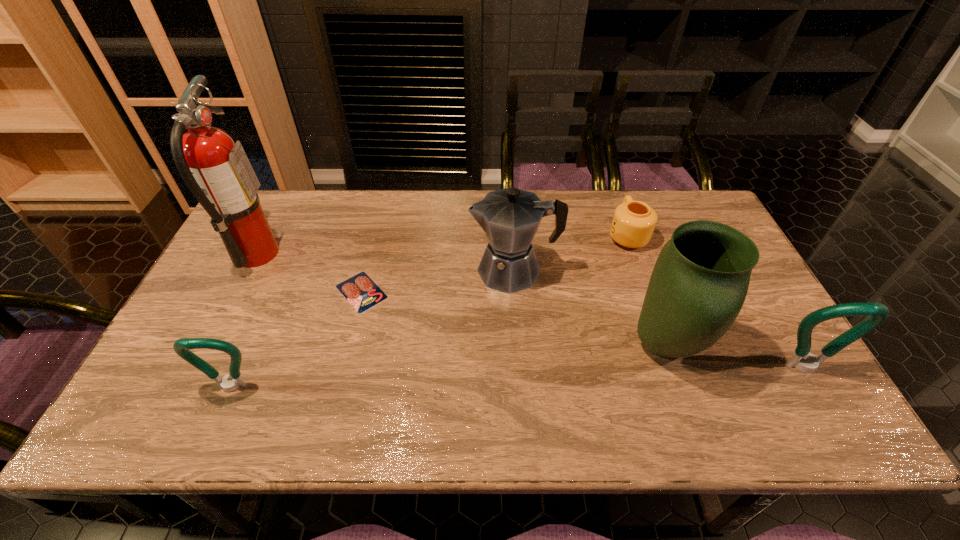
Identify the location of free space located on the handle side of the mug. Image resolution: width=960 pixels, height=540 pixels. (612, 193).

In order to click on vacant point located 0.150m on the handle side of the mug in this screenshot , I will do `click(612, 191)`.

At what (x,y) coordinates should I click in order to perform the action: click on free space located 0.130m on the handle side of the mug. Please return your answer as a coordinate pair (x, y). Looking at the image, I should click on (612, 194).

Identify the location of vacant region located 0.250m on the nozzle side of the fire extinguisher. (362, 254).

At what (x,y) coordinates should I click in order to perform the action: click on free space located on the front of the salami. Please return your answer as a coordinate pair (x, y). The image size is (960, 540). Looking at the image, I should click on (342, 369).

The height and width of the screenshot is (540, 960). Find the location of `free space located at the spout of the fourth object from left to right`. free space located at the spout of the fourth object from left to right is located at coordinates (438, 271).

The height and width of the screenshot is (540, 960). I want to click on vacant space located 0.210m at the spout of the fourth object from left to right, so click(396, 271).

Find the location of `free location located 0.190m at the spout of the fourth object from left to right`. free location located 0.190m at the spout of the fourth object from left to right is located at coordinates (403, 271).

I want to click on vacant space situated 0.080m on the back of the sixth shortest object, so click(644, 287).

Where is `mug at the far edge`? Image resolution: width=960 pixels, height=540 pixels. mug at the far edge is located at coordinates (633, 223).